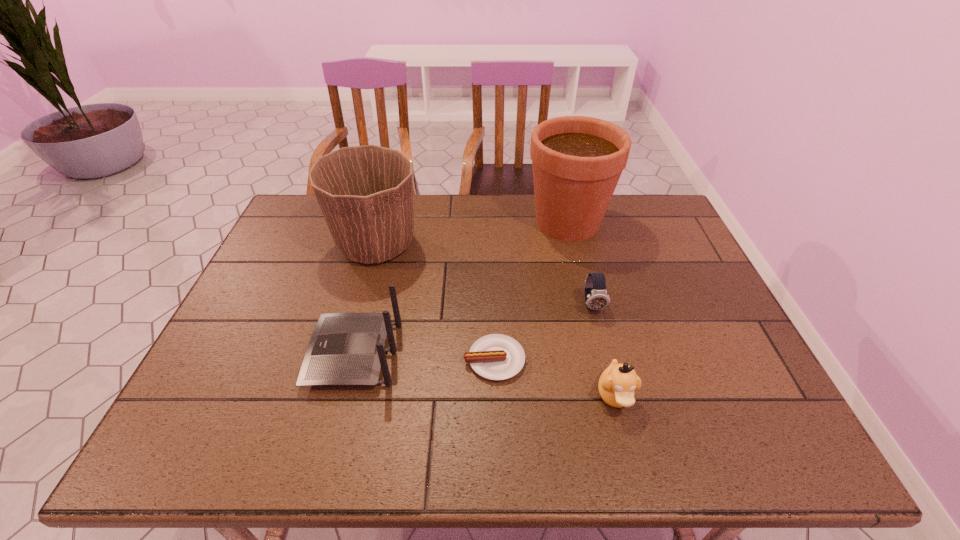
Where is `free space located 0.060m on the front-facing side of the router`? This screenshot has width=960, height=540. free space located 0.060m on the front-facing side of the router is located at coordinates (287, 354).

Identify the location of free space located 0.120m on the front-facing side of the router. The image size is (960, 540). (262, 354).

Locate an element on the screen. The image size is (960, 540). vacant region located 0.080m on the face of the duckling is located at coordinates (631, 457).

Where is `vacant space located on the face of the watch`? The width and height of the screenshot is (960, 540). vacant space located on the face of the watch is located at coordinates (601, 341).

Image resolution: width=960 pixels, height=540 pixels. I want to click on free location located 0.080m on the front of the sausage, so (x=496, y=415).

You are a GUI agent. You are given a task and a screenshot of the screen. Output one action in this format:
    pyautogui.click(x=<x>, y=<y>)
    Task: Click on the object that is at the near edge
    Image resolution: width=960 pixels, height=540 pixels.
    Given the screenshot: What is the action you would take?
    617,384

Locate an element on the screen. The width and height of the screenshot is (960, 540). vacant space at the far edge is located at coordinates (529, 214).

Identify the location of free space at the near edge. (459, 436).

In order to click on vacant region at the left edge in this screenshot , I will do `click(267, 333)`.

In the image, there is a desktop. At what (x,y) coordinates should I click in order to perform the action: click on vacant region at the right edge. Please return your answer as a coordinate pair (x, y). Image resolution: width=960 pixels, height=540 pixels. Looking at the image, I should click on (701, 388).